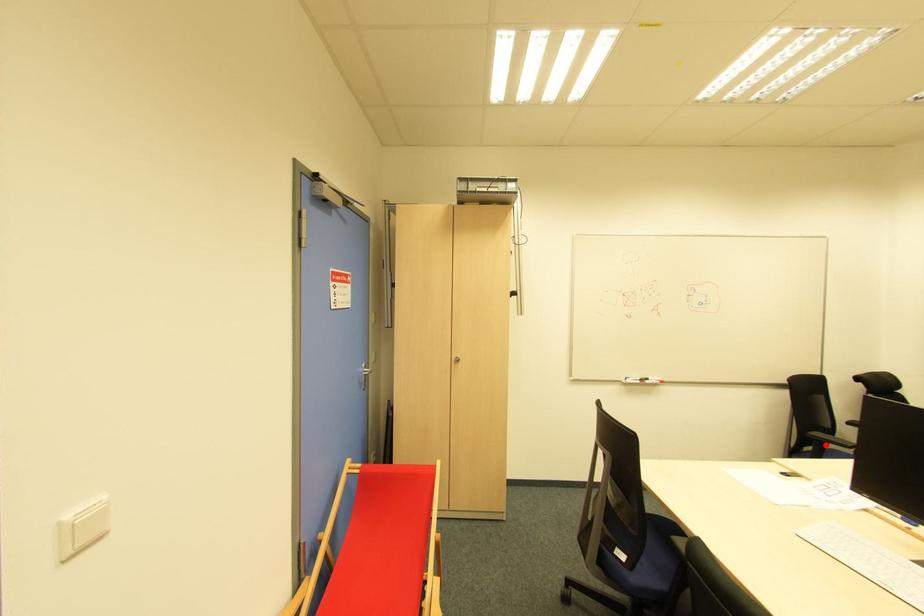
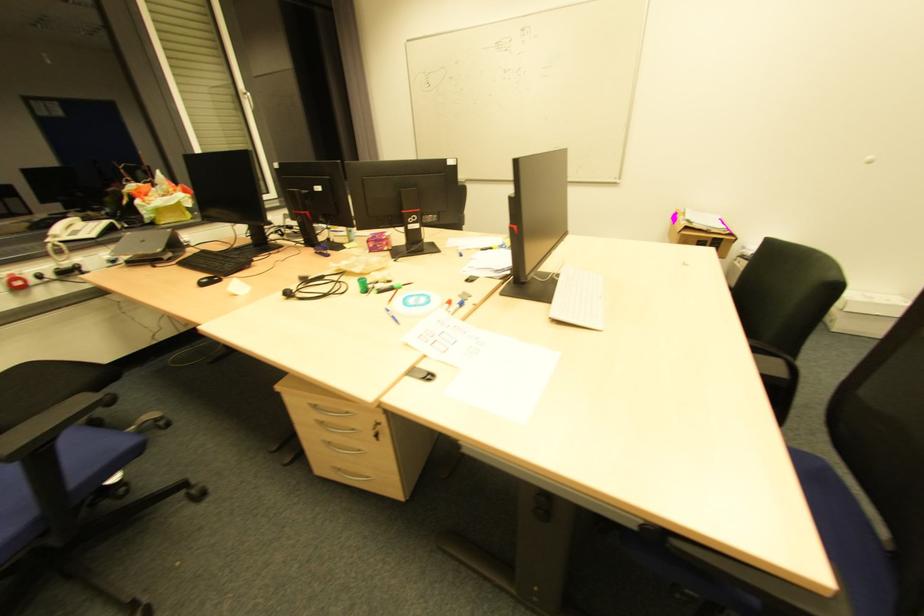
In the second image, find the point that corresponds to the highlighted location in the first image.

(51, 440)